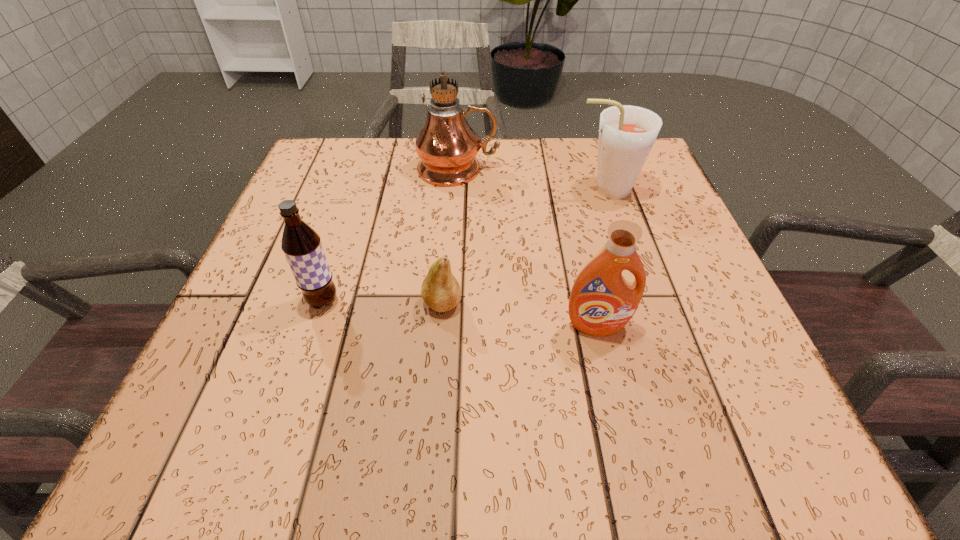
Locate an element on the screen. Image resolution: width=960 pixels, height=540 pixels. vacant position located on the front of the nearer root beer is located at coordinates (298, 379).

I want to click on vacant region located on the front-facing side of the detergent, so click(x=620, y=427).

Where is `free location located on the right of the pear`? Image resolution: width=960 pixels, height=540 pixels. free location located on the right of the pear is located at coordinates (616, 303).

Find the location of a particular element. The image size is (960, 540). oil lamp at the far edge is located at coordinates (447, 146).

You are a GUI agent. You are given a task and a screenshot of the screen. Output one action in this format:
    pyautogui.click(x=<x>, y=<y>)
    Task: Click on the root beer situated at the far edge
    The image size is (960, 540).
    Given the screenshot: What is the action you would take?
    pyautogui.click(x=627, y=133)

At what (x,y) coordinates should I click in order to perform the action: click on object that is at the left edge. Please return your answer as a coordinate pair (x, y). Looking at the image, I should click on (301, 244).

Locate an element on the screen. The height and width of the screenshot is (540, 960). object that is at the right edge is located at coordinates (627, 133).

Image resolution: width=960 pixels, height=540 pixels. In order to click on object positioned at the far right corner in this screenshot , I will do `click(627, 133)`.

At what (x,y) coordinates should I click in order to perform the action: click on vacant space at the far edge. Please return your answer as a coordinate pair (x, y). Looking at the image, I should click on (398, 152).

The height and width of the screenshot is (540, 960). Find the location of `free space at the near edge of the desktop`. free space at the near edge of the desktop is located at coordinates (338, 433).